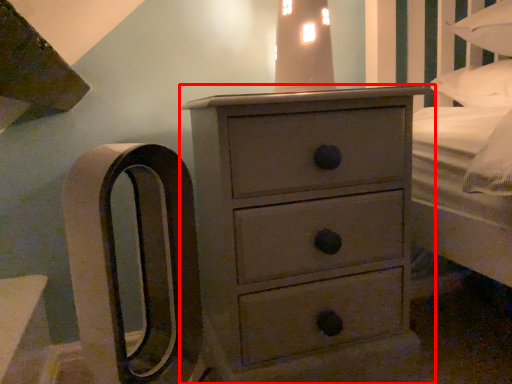
Question: From the image's perspective, considering the relative positions of chest of drawers (annotated by the red box) and bedside lamp in the image provided, where is chest of drawers (annotated by the red box) located with respect to the staircase?

Choices:
 (A) above
 (B) below

Answer: (B)